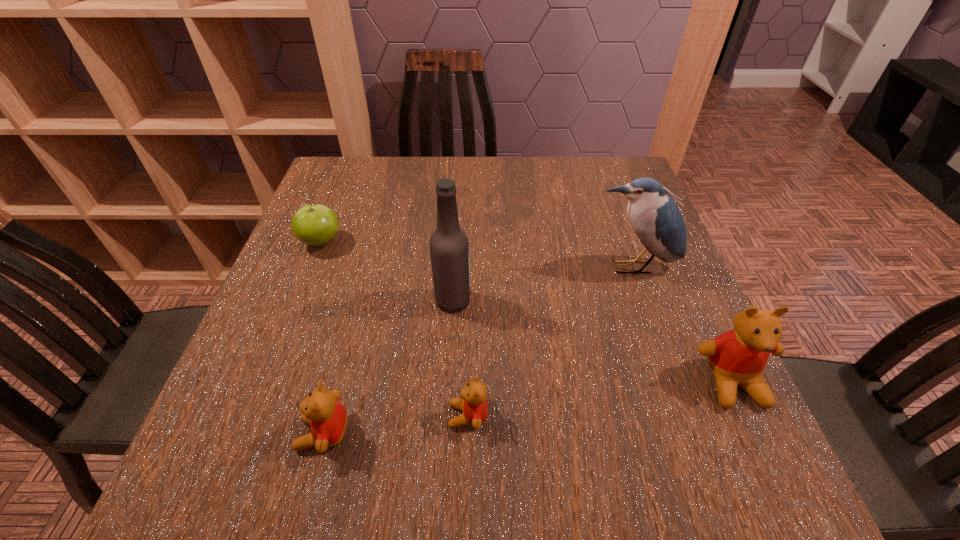
Find the location of `unoccupied position between the apple and the third tallest object`. unoccupied position between the apple and the third tallest object is located at coordinates (527, 313).

This screenshot has width=960, height=540. In order to click on free spot between the bird and the apple in this screenshot , I will do `click(477, 254)`.

This screenshot has height=540, width=960. Identify the location of vacant area that lies between the second shortest teddy bear and the fourth nearest object. (388, 367).

This screenshot has width=960, height=540. What are the coordinates of `empty location between the second object from left to right and the leftmost object` in the screenshot? It's located at (323, 338).

I want to click on free area in between the apple and the fourth shortest object, so click(527, 313).

The height and width of the screenshot is (540, 960). I want to click on vacant area that lies between the apple and the second shortest teddy bear, so click(323, 338).

This screenshot has height=540, width=960. In order to click on vacant area that lies between the third tallest object and the second teddy bear from left to right in this screenshot , I will do `click(600, 399)`.

This screenshot has width=960, height=540. Identify the location of free space between the fifth shortest object and the tallest teddy bear. (683, 325).

Select which object is the fifth closest to the shortest object. Please provide its 2D coordinates. Your answer should be formatted as a tuple, i.e. [(x, y)], where the tuple contains the x and y coordinates of a point satisfying the conditions above.

[(316, 225)]

Identify which object is the nearest to the bird. Please provide its 2D coordinates. Your answer should be formatted as a tuple, i.e. [(x, y)], where the tuple contains the x and y coordinates of a point satisfying the conditions above.

[(738, 357)]